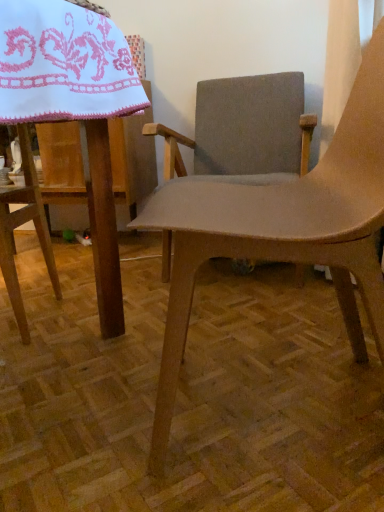
You are a GUI agent. You are given a task and a screenshot of the screen. Output one action in this format:
    pyautogui.click(x=<x>, y=<y>)
    Task: Click on the unoccupied area behind matte brown chair at center, the 1th chair when ordered from front to back
    
    Given the screenshot: What is the action you would take?
    pyautogui.click(x=270, y=318)